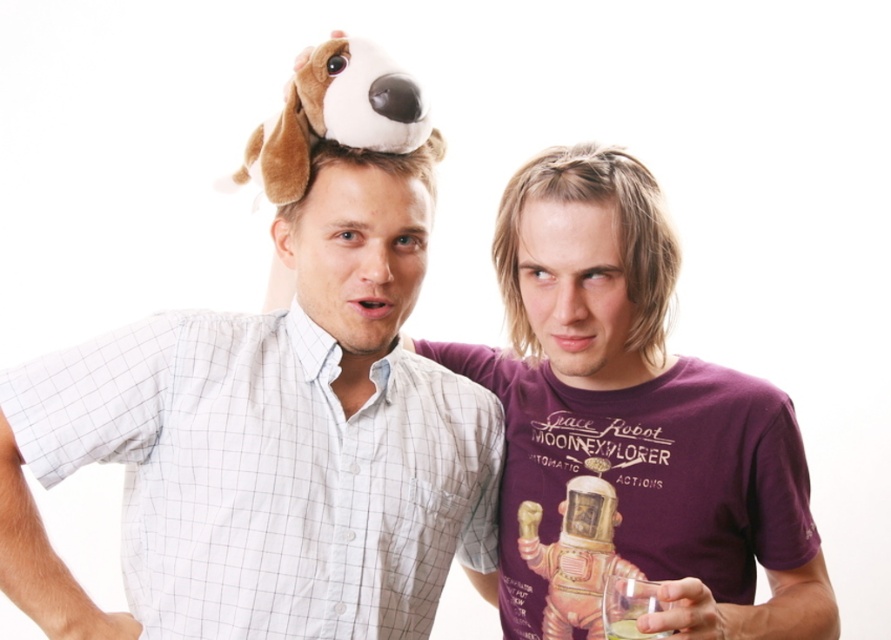
Is point (415, 248) positioned before point (688, 419)?

Yes, it is in front of point (688, 419).

Is point (366, 161) less distant than point (603, 378)?

Yes, it is.

At what (x,y) coordinates should I click in order to perform the action: click on plush toy dog at center. Please return your answer as a coordinate pair (x, y). Image resolution: width=891 pixels, height=640 pixels. Looking at the image, I should click on (276, 412).

Can you confirm if matte purple shirt at center is wider than translucent glass at lower right?

Yes.

Which of these two, matte purple shirt at center or translucent glass at lower right, stands shorter?

translucent glass at lower right is shorter.

What do you see at coordinates (619, 234) in the screenshot? The image size is (891, 640). I see `matte purple shirt at center` at bounding box center [619, 234].

The image size is (891, 640). Find the location of `matte purple shirt at center`. matte purple shirt at center is located at coordinates (619, 234).

Between plush toy dog at center and brown plush dog at center, which one has more height?

plush toy dog at center

Locate an element on the screen. This screenshot has height=640, width=891. plush toy dog at center is located at coordinates (276, 412).

This screenshot has width=891, height=640. What are the coordinates of `plush toy dog at center` in the screenshot? It's located at (276, 412).